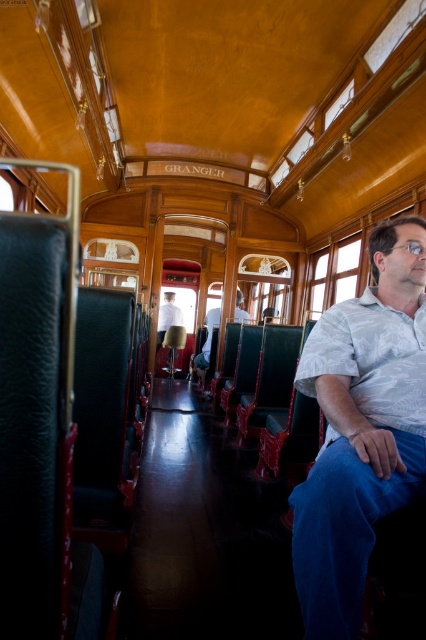
Question: Which of these objects is positioned farthest from the light blue shirt at center?

Choices:
 (A) white cotton shirt at center
 (B) white shirt at center

Answer: (A)

Question: Which object is positioned closest to the white cotton shirt at center?

Choices:
 (A) white shirt at center
 (B) light blue shirt at center

Answer: (B)

Question: Can you confirm if light blue shirt at center is positioned to the left of white shirt at center?

Choices:
 (A) no
 (B) yes

Answer: (A)

Question: Is light blue shirt at center behind white shirt at center?

Choices:
 (A) yes
 (B) no

Answer: (B)

Question: Based on their relative distances, which object is farther from the light blue shirt at center?

Choices:
 (A) white cotton shirt at center
 (B) white shirt at center

Answer: (A)

Question: Does light blue shirt at center lie behind white shirt at center?

Choices:
 (A) yes
 (B) no

Answer: (B)